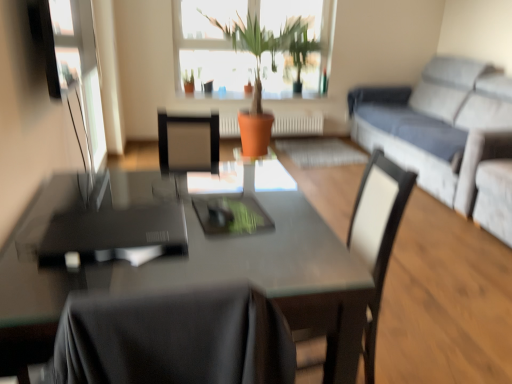
Locate an element on the screen. empty space that is to the right of white leather chair at center is located at coordinates (405, 352).